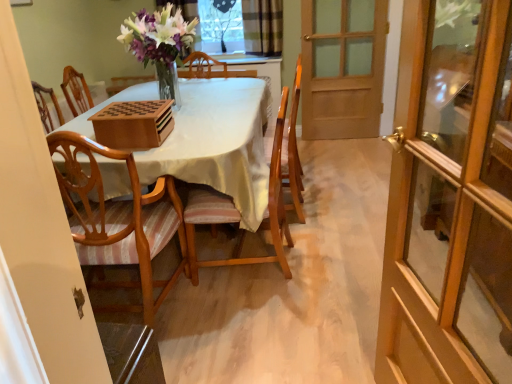
Question: In terms of height, does wooden glass door at right, arranged as the 1th door when viewed from the front, look taller or shorter compared to clear glass window at upper center?

Choices:
 (A) tall
 (B) short

Answer: (A)

Question: Would you say wooden glass door at right, arranged as the 1th door when viewed from the front, is to the left or to the right of clear glass window at upper center in the picture?

Choices:
 (A) right
 (B) left

Answer: (A)

Question: Estimate the real-world distances between objects in this image. Which object is farther from the plaid fabric curtain at upper center?

Choices:
 (A) wooden chair with striped cushion at center, which appears as the 2th chair when viewed from the left
 (B) light brown wood chair at left, which is the 1th chair from left to right
 (C) wooden door at right, the 1th door viewed from the back
 (D) wooden table at center
 (E) clear glass window at upper center

Answer: (B)

Question: Estimate the real-world distances between objects in this image. Which object is farther from the plaid fabric curtain at upper center?

Choices:
 (A) wooden chair with striped cushion at center, positioned as the 1th chair in right-to-left order
 (B) wooden glass door at right, which is counted as the 2th door, starting from the top
 (C) light brown wood chair at left, which is the 1th chair from left to right
 (D) wooden door at right, which is counted as the 2th door, starting from the bottom
 (E) clear glass window at upper center

Answer: (C)